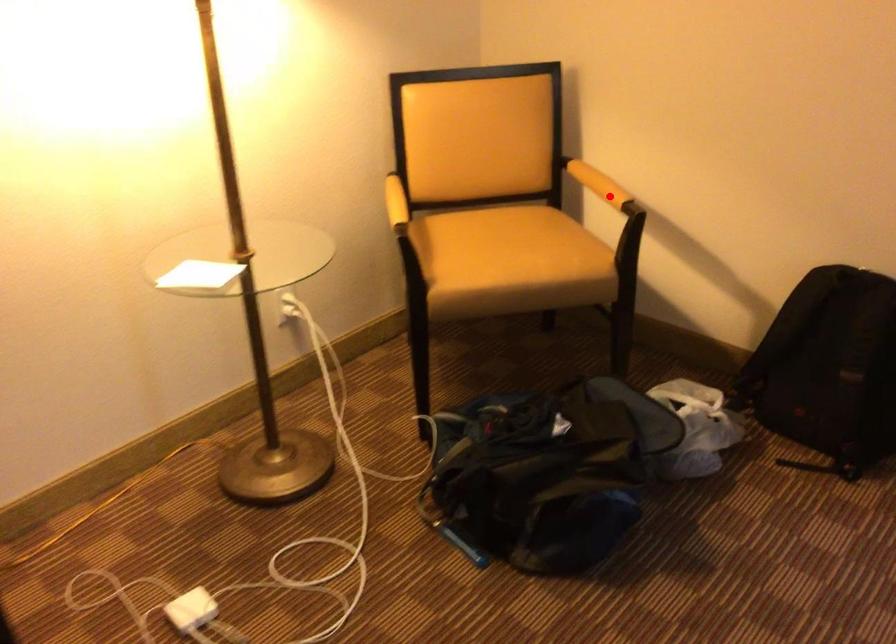
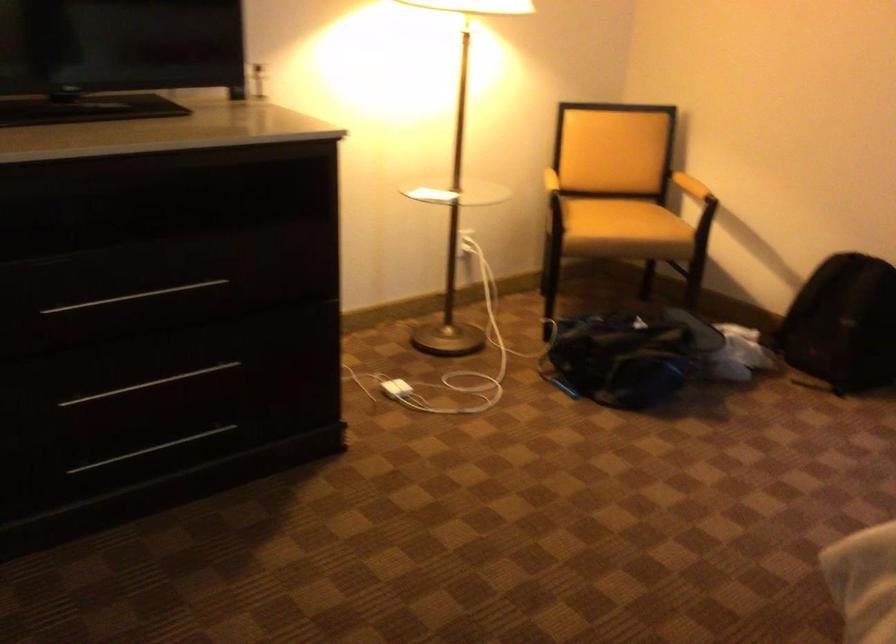
Question: I am providing you with two images of the same scene from different viewpoints. A red point is shown in image1. For the corresponding object point in image2, is it positioned nearer or farther from the camera?

Choices:
 (A) Nearer
 (B) Farther

Answer: (B)